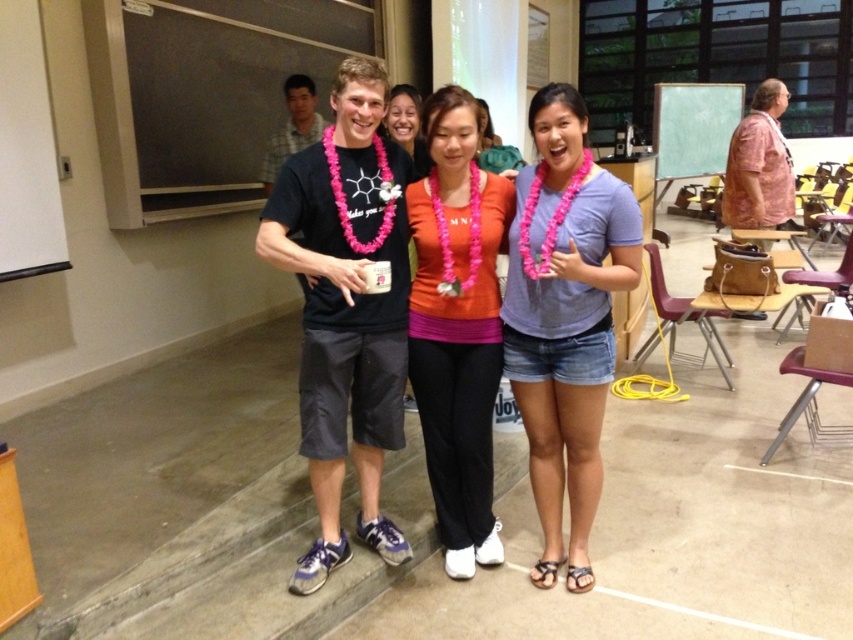
Question: Which of the following is the farthest from the observer?

Choices:
 (A) (376, 300)
 (B) (392, 108)
 (C) (732, 224)

Answer: (C)

Question: Is orange fabric shirt at center closer to the viewer compared to light brown plaid shirt at center?

Choices:
 (A) no
 (B) yes

Answer: (B)

Question: Is denim shorts at center bigger than pink fabric lei at center?

Choices:
 (A) no
 (B) yes

Answer: (B)

Question: Which point appears farthest from the camera in this image?

Choices:
 (A) (303, 108)
 (B) (438, 301)

Answer: (A)

Question: Is pink floral shirt at right to the right of light brown plaid shirt at center from the viewer's perspective?

Choices:
 (A) no
 (B) yes

Answer: (B)

Question: Among these points, which one is nearest to the camera?

Choices:
 (A) (427, 388)
 (B) (381, 189)
 (C) (740, 163)

Answer: (B)